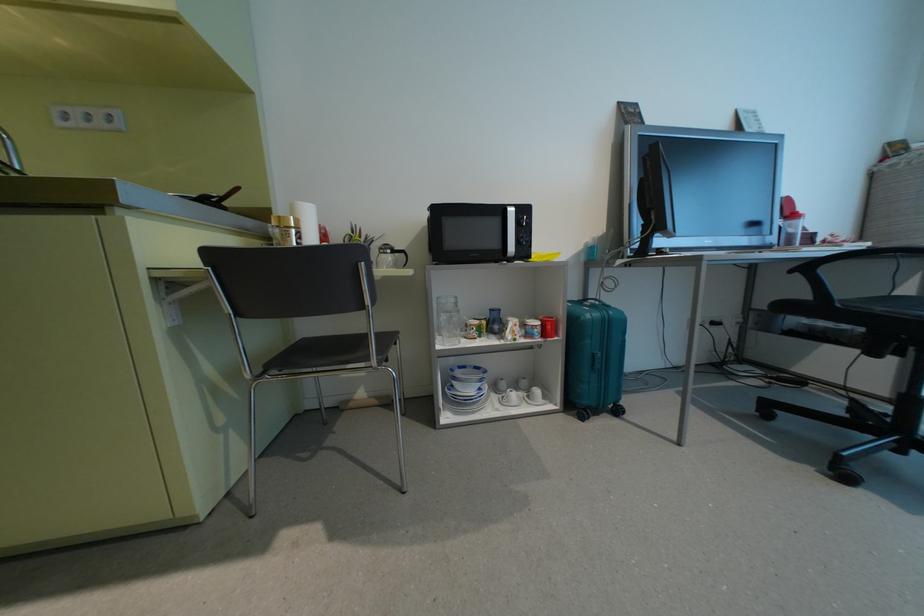
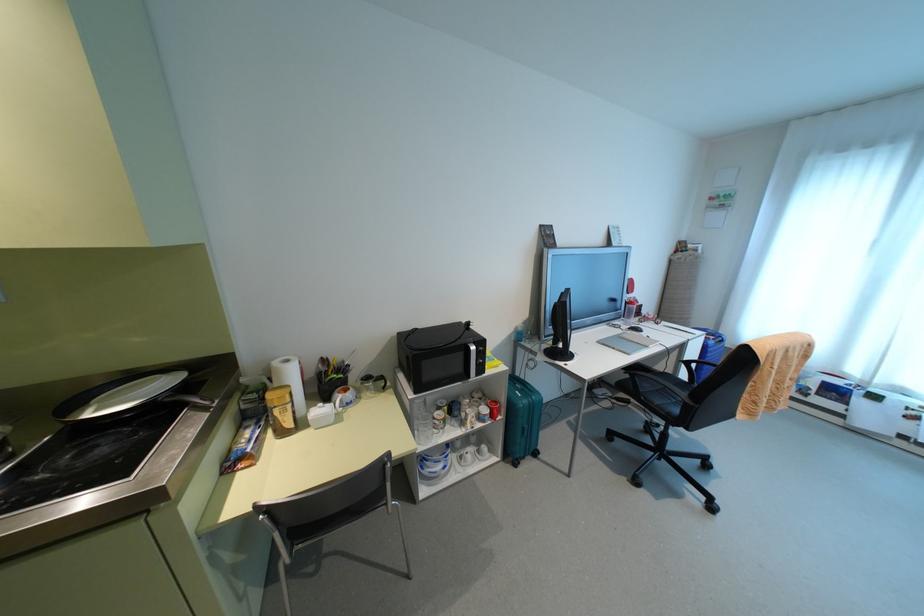
The point at (537, 391) is marked in the first image. Where is the corresponding point in the second image?

(483, 447)